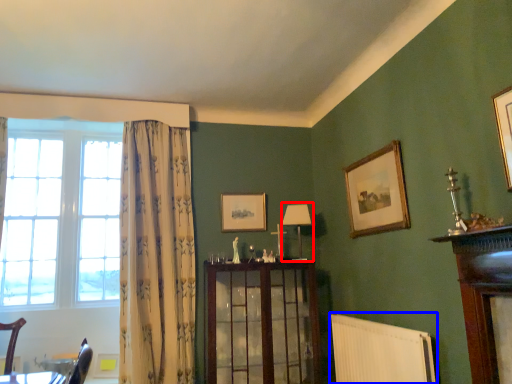
Question: Which object appears farthest to the camera in this image, lamp (highlighted by a red box) or radiator (highlighted by a blue box)?

Choices:
 (A) lamp
 (B) radiator

Answer: (A)